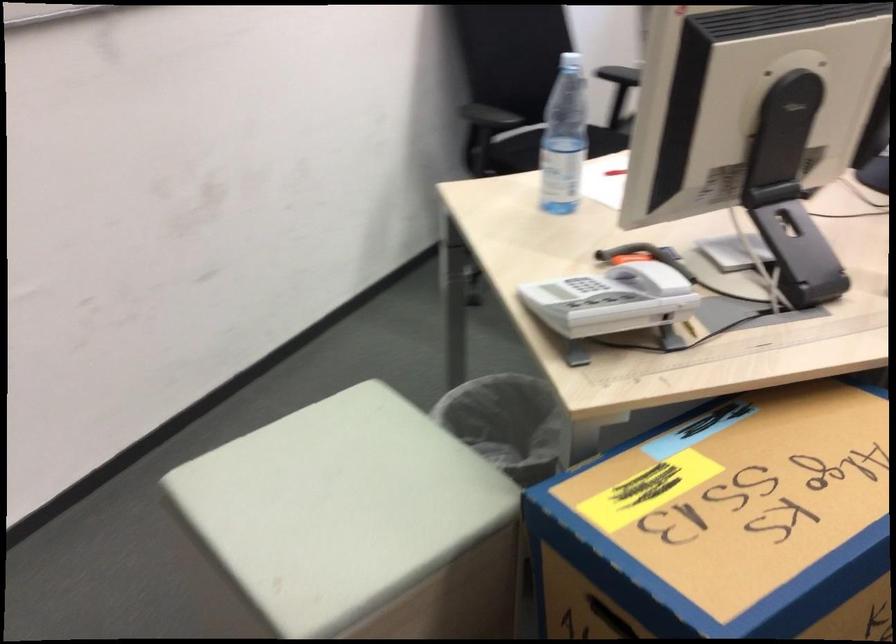
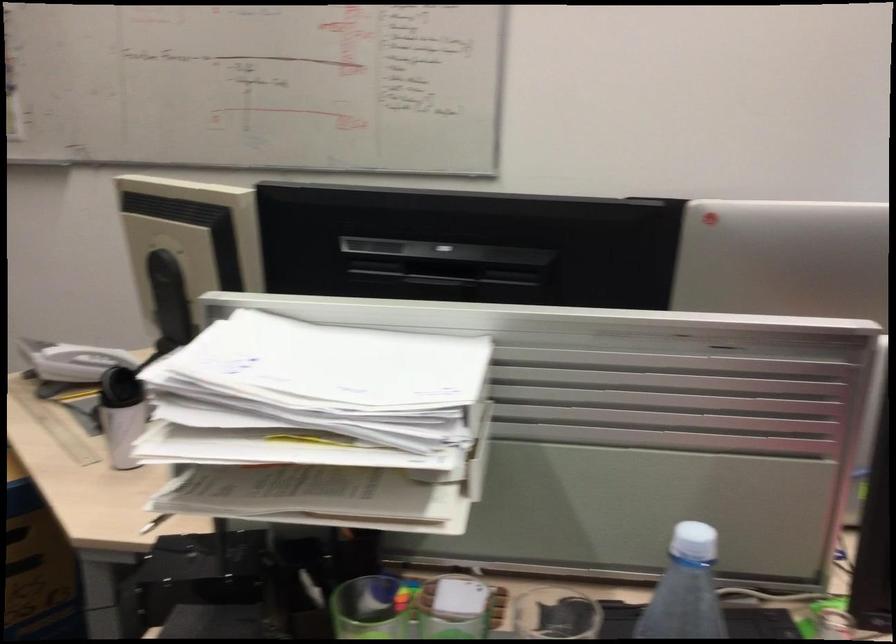
Locate, in the second image, the point that corresponds to point (668, 287) in the first image.

(72, 361)